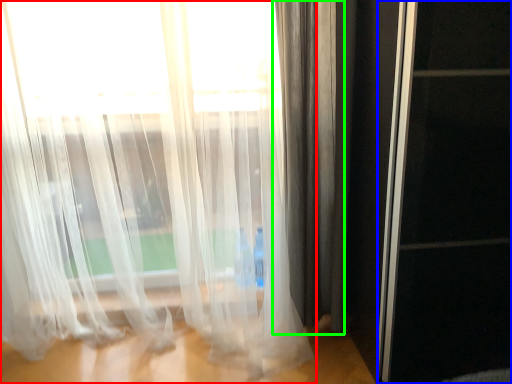
Question: Which object is the farthest from curtain (highlighted by a red box)? Choose among these: screen door (highlighted by a blue box) or curtain (highlighted by a green box).

Choices:
 (A) screen door
 (B) curtain

Answer: (A)